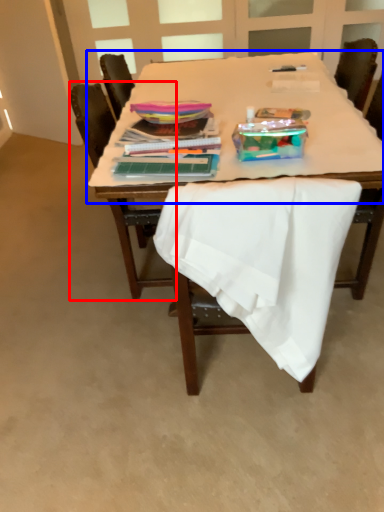
Question: Which point is further to the camera, chair (highlighted by a red box) or round table (highlighted by a blue box)?

Choices:
 (A) chair
 (B) round table

Answer: (A)